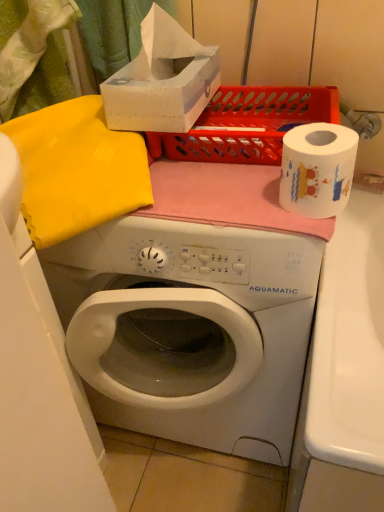
Question: Does matte plastic crate at upper center have a smaller size compared to white cardboard tissue box at upper center?

Choices:
 (A) yes
 (B) no

Answer: (B)

Question: Considering the relative sizes of matte plastic crate at upper center and white cardboard tissue box at upper center in the image provided, is matte plastic crate at upper center wider than white cardboard tissue box at upper center?

Choices:
 (A) no
 (B) yes

Answer: (B)

Question: From a real-world perspective, is matte plastic crate at upper center under white cardboard tissue box at upper center?

Choices:
 (A) no
 (B) yes

Answer: (B)

Question: Can we say matte plastic crate at upper center lies outside white cardboard tissue box at upper center?

Choices:
 (A) yes
 (B) no

Answer: (A)

Question: Is matte plastic crate at upper center to the left of white cardboard tissue box at upper center from the viewer's perspective?

Choices:
 (A) yes
 (B) no

Answer: (B)

Question: Is white plastic washing machine at center bigger or smaller than white cardboard tissue box at upper center?

Choices:
 (A) small
 (B) big

Answer: (B)

Question: From their relative heights in the image, would you say white plastic washing machine at center is taller or shorter than white cardboard tissue box at upper center?

Choices:
 (A) tall
 (B) short

Answer: (A)

Question: From the image's perspective, is white plastic washing machine at center above or below white cardboard tissue box at upper center?

Choices:
 (A) below
 (B) above

Answer: (A)

Question: From a real-world perspective, is white plastic washing machine at center above or below white cardboard tissue box at upper center?

Choices:
 (A) below
 (B) above

Answer: (A)

Question: Is point (x=284, y=300) closer or farther from the camera than point (x=344, y=194)?

Choices:
 (A) farther
 (B) closer

Answer: (A)

Question: From a real-world perspective, is white plastic washing machine at center positioned above or below white paper at right?

Choices:
 (A) below
 (B) above

Answer: (A)

Question: Choose the correct answer: Is white plastic washing machine at center inside white paper at right or outside it?

Choices:
 (A) inside
 (B) outside

Answer: (B)

Question: Considering the positions of white plastic washing machine at center and white paper at right in the image, is white plastic washing machine at center taller or shorter than white paper at right?

Choices:
 (A) short
 (B) tall

Answer: (B)

Question: From a real-world perspective, is white cardboard tissue box at upper center positioned above or below white plastic washing machine at center?

Choices:
 (A) below
 (B) above

Answer: (B)

Question: Based on their positions, is white cardboard tissue box at upper center located to the left or right of white plastic washing machine at center?

Choices:
 (A) right
 (B) left

Answer: (B)